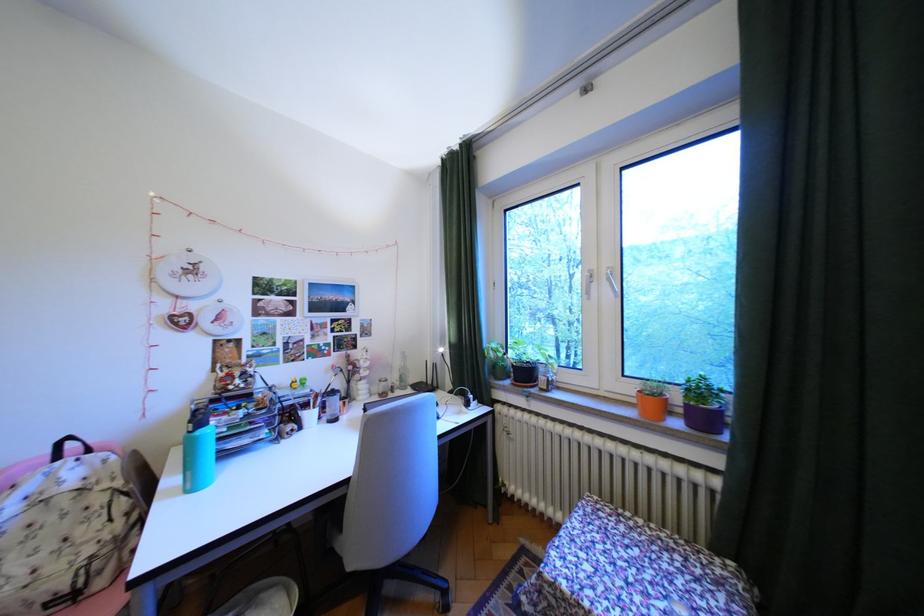
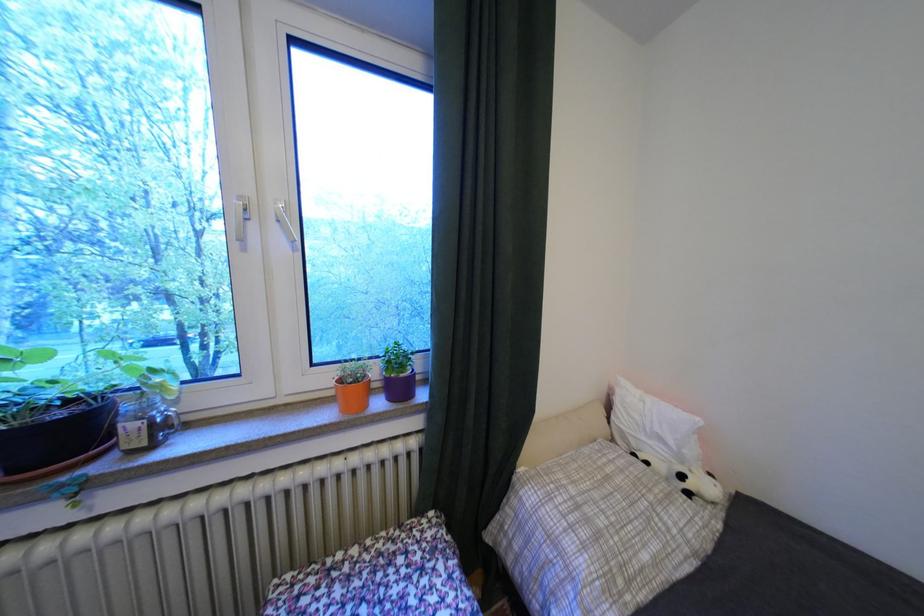
The point at (553, 370) is marked in the first image. Where is the corresponding point in the second image?

(138, 408)